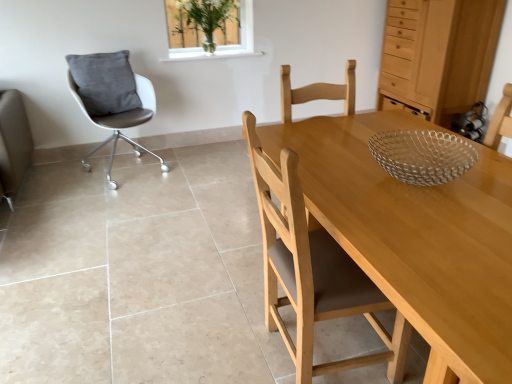
Identify the location of white leather chair at left, which ranks as the second chair in right-to-left order. Image resolution: width=512 pixels, height=384 pixels. (111, 98).

Image resolution: width=512 pixels, height=384 pixels. What do you see at coordinates (312, 271) in the screenshot?
I see `light brown wood chair at center, which ranks as the first chair in front-to-back order` at bounding box center [312, 271].

Find the location of a particular element. gray velvety pillow at left is located at coordinates (104, 83).

This screenshot has height=384, width=512. What are the coordinates of `clear glass vase at upper center` in the screenshot? It's located at (225, 45).

Does white leather chair at left, which ranks as the second chair in right-to-left order, have a smaller size compared to light brown wood chair at center, which is counted as the first chair, starting from the right?

No, white leather chair at left, which ranks as the second chair in right-to-left order, is not smaller than light brown wood chair at center, which is counted as the first chair, starting from the right.

Is white leather chair at left, acting as the 2th chair starting from the front, positioned before light brown wood chair at center, which is counted as the first chair, starting from the right?

No.

From the image's perspective, relative to light brown wood chair at center, which is counted as the first chair, starting from the right, is white leather chair at left, acting as the 2th chair starting from the front, above or below?

white leather chair at left, acting as the 2th chair starting from the front, is above light brown wood chair at center, which is counted as the first chair, starting from the right.

Is white leather chair at left, the first chair positioned from the back, positioned far away from light brown wood chair at center, which is the second chair in back-to-front order?

Absolutely, white leather chair at left, the first chair positioned from the back, is distant from light brown wood chair at center, which is the second chair in back-to-front order.

From the image's perspective, which is below, clear glass vase at upper center or light wood dresser at upper right?

light wood dresser at upper right appears lower in the image.

Who is smaller, clear glass vase at upper center or light wood dresser at upper right?

Smaller between the two is clear glass vase at upper center.

Visually, is clear glass vase at upper center positioned to the left or to the right of light wood dresser at upper right?

From the image, it's evident that clear glass vase at upper center is to the left of light wood dresser at upper right.

Is clear glass vase at upper center outside of light wood dresser at upper right?

Yes, clear glass vase at upper center is not within light wood dresser at upper right.

From a real-world perspective, is light brown wood chair at center, positioned as the second chair in left-to-right order, positioned above or below clear glass vase at upper center?

light brown wood chair at center, positioned as the second chair in left-to-right order, is below clear glass vase at upper center.

Considering the positions of point (380, 309) and point (249, 19), is point (380, 309) closer or farther from the camera than point (249, 19)?

Point (380, 309) appears to be closer to the viewer than point (249, 19).

Between light brown wood chair at center, which is the second chair in back-to-front order, and clear glass vase at upper center, which one has more height?

With more height is light brown wood chair at center, which is the second chair in back-to-front order.

From the picture: Does light brown wood chair at center, which is counted as the first chair, starting from the right, have a larger size compared to clear glass vase at upper center?

Correct, light brown wood chair at center, which is counted as the first chair, starting from the right, is larger in size than clear glass vase at upper center.

Is gray velvety pillow at left completely or partially outside of clear glass vase at upper center?

Indeed, gray velvety pillow at left is completely outside clear glass vase at upper center.

From the image's perspective, is gray velvety pillow at left above or below clear glass vase at upper center?

Clearly, from the image's perspective, gray velvety pillow at left is below clear glass vase at upper center.

Does gray velvety pillow at left lie behind clear glass vase at upper center?

No, it is not.

Looking at this image, is gray velvety pillow at left shorter than clear glass vase at upper center?

No.

Are light brown wood chair at center, which is the second chair in back-to-front order, and white leather chair at left, the 1th chair positioned from the left, beside each other?

No, light brown wood chair at center, which is the second chair in back-to-front order, is not in contact with white leather chair at left, the 1th chair positioned from the left.

Could you tell me if light brown wood chair at center, which ranks as the first chair in front-to-back order, is facing white leather chair at left, the first chair positioned from the back?

No.

From the picture: Could you measure the distance between light brown wood chair at center, which is the second chair in back-to-front order, and white leather chair at left, the first chair positioned from the back?

light brown wood chair at center, which is the second chair in back-to-front order, is 2.17 meters from white leather chair at left, the first chair positioned from the back.

Is point (349, 292) behind point (96, 124)?

That is False.

Can you tell me how much clear glass vase at upper center and light brown wood chair at center, which ranks as the first chair in front-to-back order, differ in facing direction?

clear glass vase at upper center and light brown wood chair at center, which ranks as the first chair in front-to-back order, are facing 92.6 degrees away from each other.

From the image's perspective, which object appears higher, clear glass vase at upper center or light brown wood chair at center, positioned as the second chair in left-to-right order?

clear glass vase at upper center.

Does clear glass vase at upper center contain light brown wood chair at center, which is the second chair in back-to-front order?

No, light brown wood chair at center, which is the second chair in back-to-front order, is not surrounded by clear glass vase at upper center.

Is the depth of clear glass vase at upper center greater than that of white leather chair at left, which ranks as the second chair in right-to-left order?

Yes.

Can white leather chair at left, which ranks as the second chair in right-to-left order, be found inside clear glass vase at upper center?

That's incorrect, white leather chair at left, which ranks as the second chair in right-to-left order, is not inside clear glass vase at upper center.

Between clear glass vase at upper center and white leather chair at left, which ranks as the second chair in right-to-left order, which one appears on the right side from the viewer's perspective?

From the viewer's perspective, clear glass vase at upper center appears more on the right side.

From a real-world perspective, which is physically below, clear glass vase at upper center or white leather chair at left, acting as the 2th chair starting from the front?

white leather chair at left, acting as the 2th chair starting from the front, is physically lower.

Where is `chair below the white leather chair at left, acting as the 2th chair starting from the front (from the image's perspective)`? chair below the white leather chair at left, acting as the 2th chair starting from the front (from the image's perspective) is located at coordinates (312, 271).

The width and height of the screenshot is (512, 384). I want to click on dresser below the clear glass vase at upper center (from a real-world perspective), so point(439,54).

Which object lies further to the anchor point clear glass vase at upper center, white leather chair at left, which ranks as the second chair in right-to-left order, or light wood dresser at upper right?

light wood dresser at upper right.

Based on their spatial positions, is white leather chair at left, the first chair positioned from the back, or light brown wood chair at center, which is the second chair in back-to-front order, closer to clear glass vase at upper center?

white leather chair at left, the first chair positioned from the back, is positioned closer to the anchor clear glass vase at upper center.

Which object lies nearer to the anchor point white leather chair at left, the first chair positioned from the back, gray velvety pillow at left or light wood dresser at upper right?

gray velvety pillow at left is positioned closer to the anchor white leather chair at left, the first chair positioned from the back.

Looking at the image, which one is located closer to clear glass vase at upper center, white leather chair at left, the first chair positioned from the back, or gray velvety pillow at left?

Based on the image, white leather chair at left, the first chair positioned from the back, appears to be nearer to clear glass vase at upper center.

Looking at the image, which one is located closer to gray velvety pillow at left, light brown wood chair at center, positioned as the second chair in left-to-right order, or white leather chair at left, acting as the 2th chair starting from the front?

Based on the image, white leather chair at left, acting as the 2th chair starting from the front, appears to be nearer to gray velvety pillow at left.

Based on their spatial positions, is white leather chair at left, which ranks as the second chair in right-to-left order, or light brown wood chair at center, positioned as the second chair in left-to-right order, further from gray velvety pillow at left?

light brown wood chair at center, positioned as the second chair in left-to-right order, is further to gray velvety pillow at left.

Estimate the real-world distances between objects in this image. Which object is further from clear glass vase at upper center, light wood dresser at upper right or white leather chair at left, the first chair positioned from the back?

The object further to clear glass vase at upper center is light wood dresser at upper right.

From the image, which object appears to be farther from clear glass vase at upper center, gray velvety pillow at left or white leather chair at left, the first chair positioned from the back?

gray velvety pillow at left lies further to clear glass vase at upper center than the other object.

This screenshot has height=384, width=512. Identify the location of dresser located between light brown wood chair at center, which is the second chair in back-to-front order, and clear glass vase at upper center in the depth direction. (439, 54).

Image resolution: width=512 pixels, height=384 pixels. Find the location of `pillow between clear glass vase at upper center and white leather chair at left, the 1th chair positioned from the left, in the vertical direction`. pillow between clear glass vase at upper center and white leather chair at left, the 1th chair positioned from the left, in the vertical direction is located at coordinates (104, 83).

The width and height of the screenshot is (512, 384). I want to click on pillow between light brown wood chair at center, which is counted as the first chair, starting from the right, and clear glass vase at upper center, along the z-axis, so click(104, 83).

Find the location of a particular element. window situated between white leather chair at left, which ranks as the second chair in right-to-left order, and light wood dresser at upper right from left to right is located at coordinates (225, 45).